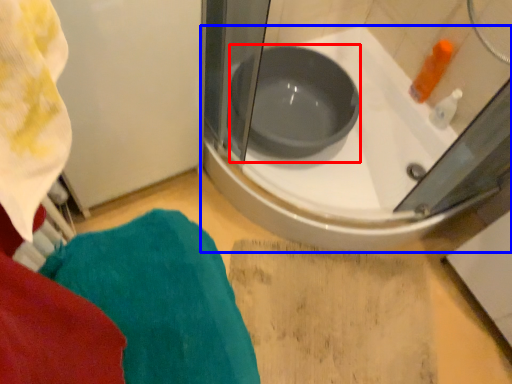
Question: Which of the following is the closest to the observer, basin (highlighted by a red box) or bathtub (highlighted by a blue box)?

Choices:
 (A) basin
 (B) bathtub

Answer: (B)